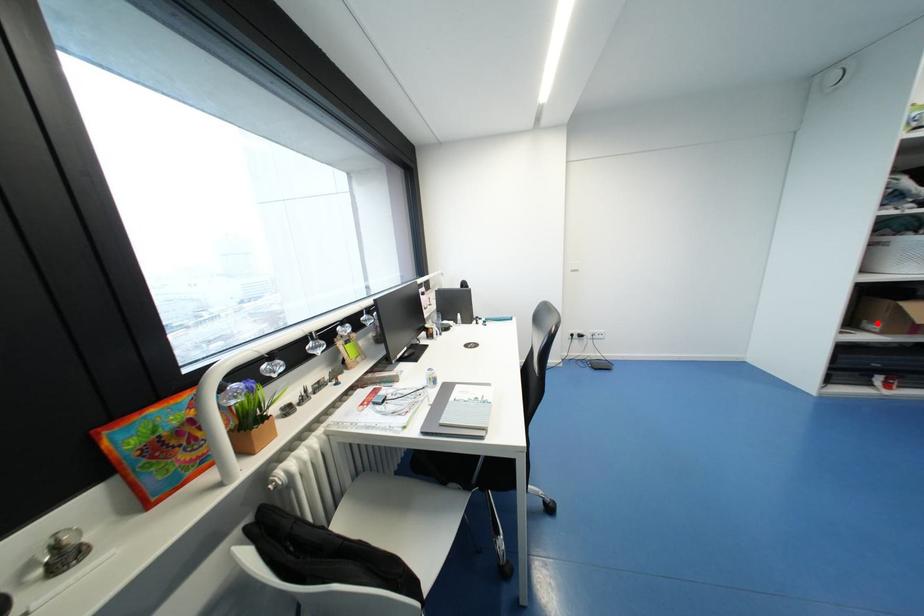
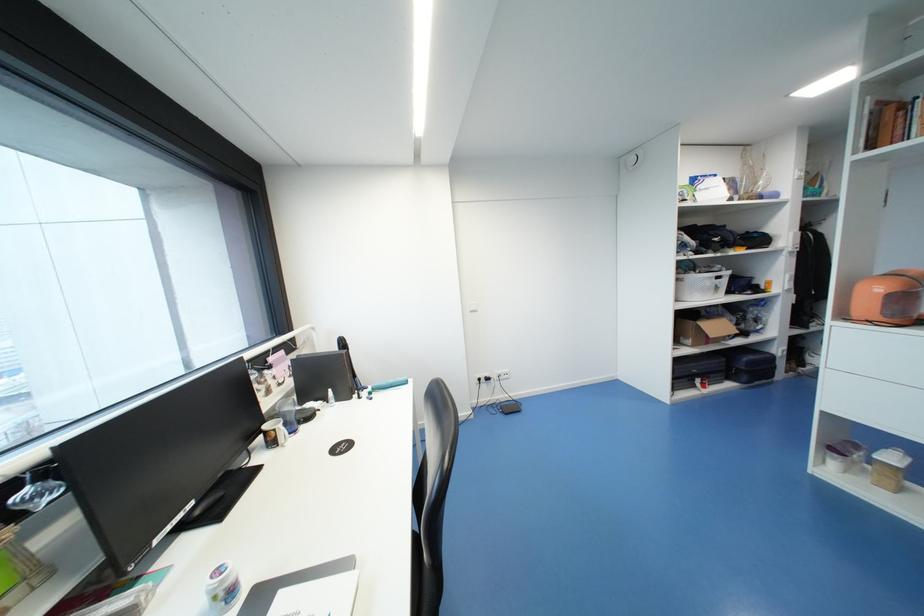
Find the pixel in the second image that matches the highlighted location in the first image.

(690, 339)